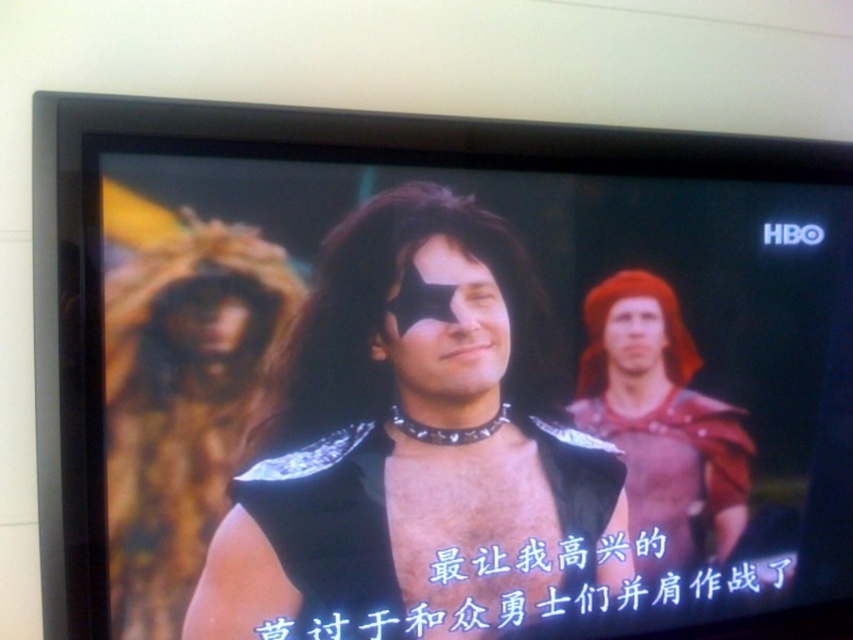
Does shiny black armor at center have a larger size compared to red leather armor at right?

Yes, shiny black armor at center is bigger than red leather armor at right.

Based on the photo, how far apart are shiny black armor at center and red leather armor at right?

shiny black armor at center is 6.34 inches from red leather armor at right.

Describe the element at coordinates (416, 449) in the screenshot. I see `shiny black armor at center` at that location.

This screenshot has width=853, height=640. I want to click on shiny black armor at center, so (x=416, y=449).